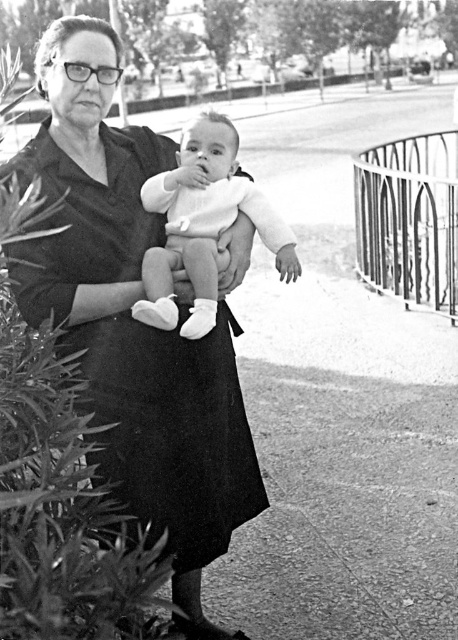
Does black matte dress at center appear under white soft baby at center?

Yes, black matte dress at center is below white soft baby at center.

Locate an element on the screen. The width and height of the screenshot is (458, 640). black matte dress at center is located at coordinates (170, 429).